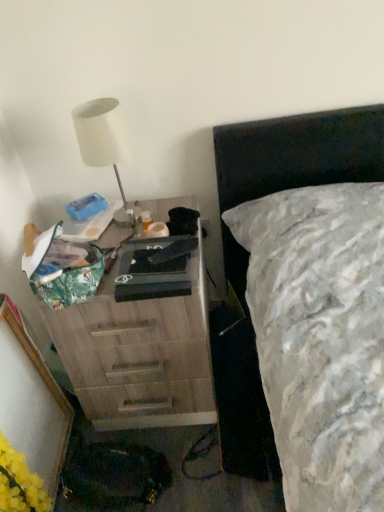
At what (x,y) coordinates should I click in order to perform the action: click on vacant space in white matte lamp at upper left (from a real-world perspective). Please return your answer as a coordinate pair (x, y). The image size is (384, 512). Looking at the image, I should click on (126, 219).